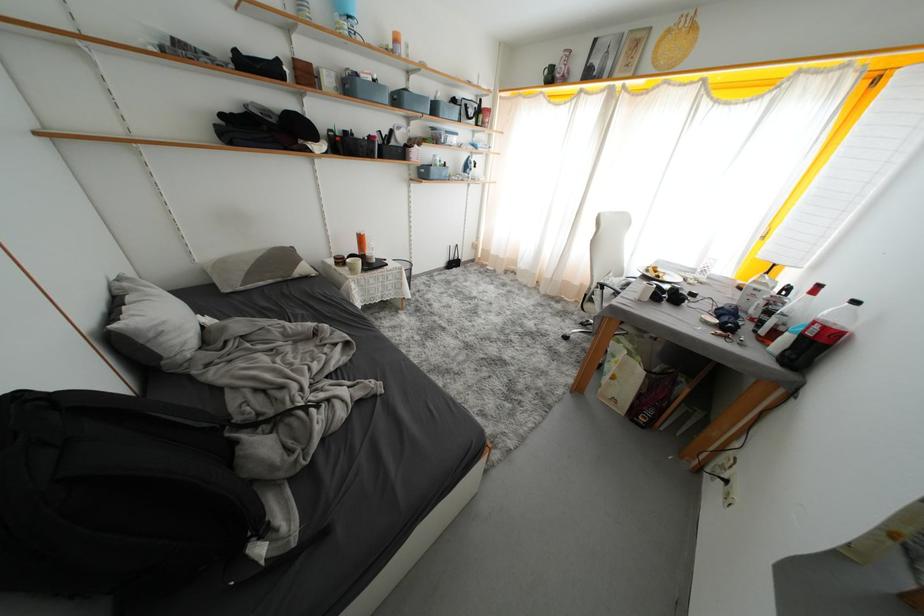
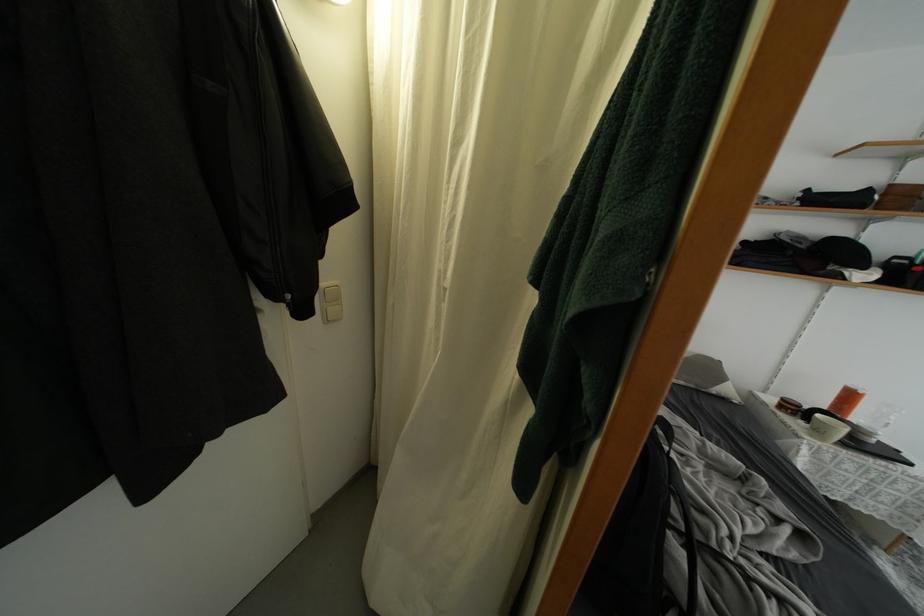
The point at (x=359, y=275) is marked in the first image. Where is the corresponding point in the second image?

(823, 437)